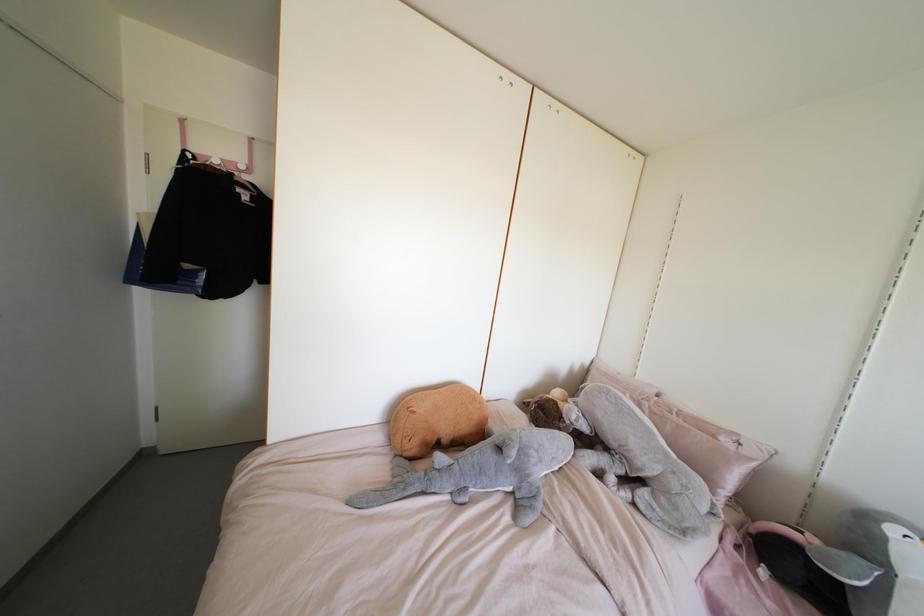
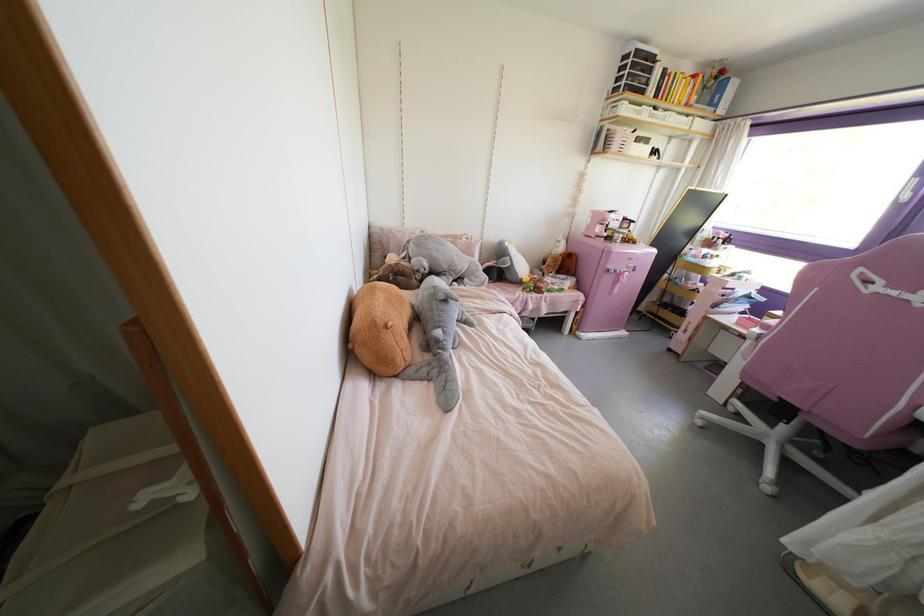
Where in the second image is the point corresponding to (x=509, y=438) from the first image?

(444, 290)